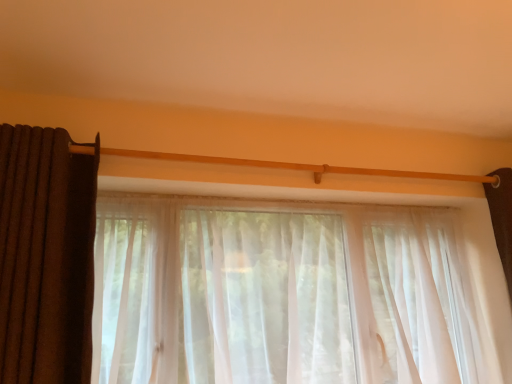
Question: Does sheer white curtain at center, marked as the 2th curtain in a left-to-right arrangement, appear on the left side of brown textured curtain at left, arranged as the second curtain when viewed from the right?

Choices:
 (A) yes
 (B) no

Answer: (B)

Question: Is sheer white curtain at center, marked as the 2th curtain in a left-to-right arrangement, further to the viewer compared to brown textured curtain at left, the 1th curtain positioned from the left?

Choices:
 (A) yes
 (B) no

Answer: (A)

Question: Can you confirm if sheer white curtain at center, marked as the 2th curtain in a left-to-right arrangement, is taller than brown textured curtain at left, arranged as the second curtain when viewed from the right?

Choices:
 (A) no
 (B) yes

Answer: (B)

Question: Considering the relative sizes of sheer white curtain at center, which is the first curtain in right-to-left order, and brown textured curtain at left, arranged as the second curtain when viewed from the right, in the image provided, is sheer white curtain at center, which is the first curtain in right-to-left order, wider than brown textured curtain at left, arranged as the second curtain when viewed from the right,?

Choices:
 (A) yes
 (B) no

Answer: (A)

Question: From the image's perspective, is sheer white curtain at center, marked as the 2th curtain in a left-to-right arrangement, beneath brown textured curtain at left, arranged as the second curtain when viewed from the right?

Choices:
 (A) yes
 (B) no

Answer: (A)

Question: Is sheer white curtain at center, marked as the 2th curtain in a left-to-right arrangement, shorter than brown textured curtain at left, the 1th curtain positioned from the left?

Choices:
 (A) no
 (B) yes

Answer: (A)

Question: Would you say brown textured curtain at left, the 1th curtain positioned from the left, is a long distance from sheer white curtain at center, marked as the 2th curtain in a left-to-right arrangement?

Choices:
 (A) no
 (B) yes

Answer: (A)

Question: Does brown textured curtain at left, arranged as the second curtain when viewed from the right, have a lesser height compared to sheer white curtain at center, which is the first curtain in right-to-left order?

Choices:
 (A) no
 (B) yes

Answer: (B)

Question: From a real-world perspective, is brown textured curtain at left, the 1th curtain positioned from the left, beneath sheer white curtain at center, marked as the 2th curtain in a left-to-right arrangement?

Choices:
 (A) yes
 (B) no

Answer: (B)

Question: Considering the relative positions of brown textured curtain at left, the 1th curtain positioned from the left, and sheer white curtain at center, which is the first curtain in right-to-left order, in the image provided, is brown textured curtain at left, the 1th curtain positioned from the left, to the right of sheer white curtain at center, which is the first curtain in right-to-left order, from the viewer's perspective?

Choices:
 (A) no
 (B) yes

Answer: (A)

Question: Is brown textured curtain at left, arranged as the second curtain when viewed from the right, with sheer white curtain at center, which is the first curtain in right-to-left order?

Choices:
 (A) no
 (B) yes

Answer: (B)

Question: Considering the relative sizes of brown textured curtain at left, the 1th curtain positioned from the left, and sheer white curtain at center, which is the first curtain in right-to-left order, in the image provided, is brown textured curtain at left, the 1th curtain positioned from the left, wider than sheer white curtain at center, which is the first curtain in right-to-left order,?

Choices:
 (A) yes
 (B) no

Answer: (B)

Question: Would you say sheer white curtain at center, marked as the 2th curtain in a left-to-right arrangement, is inside or outside brown textured curtain at left, arranged as the second curtain when viewed from the right?

Choices:
 (A) outside
 (B) inside

Answer: (A)